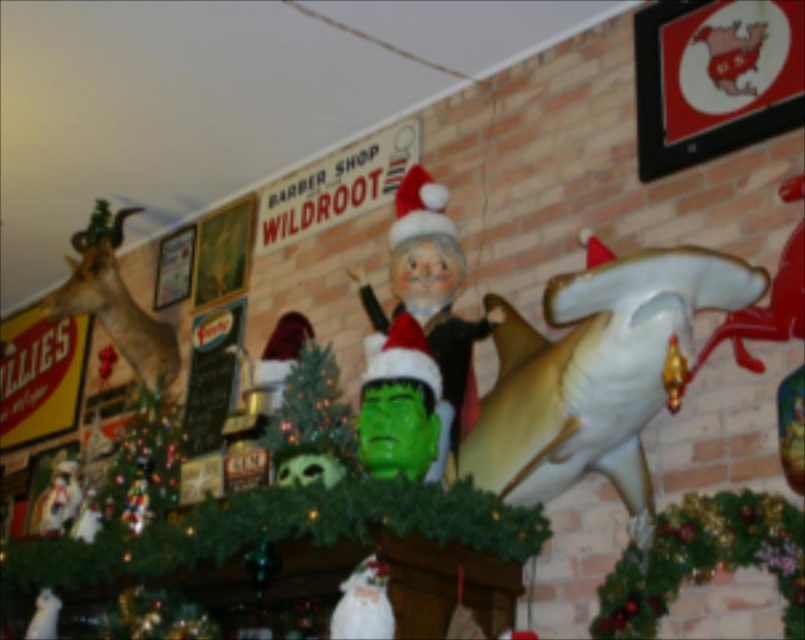
You are a visitor looking at the holiday display. You notice the white glossy shark at right and the matte plastic santa at center. Which object is positioned lower on the mantelpiece?

The white glossy shark at right is positioned lower on the mantelpiece than the matte plastic santa at center.

You are a visitor at this holiday display and want to take a photo of both the white glossy shark at right and the matte plastic santa at center. To ensure both are in frame, should you position yourself to the left or the right of the display?

You should position yourself to the left of the display so that the white glossy shark at right and the matte plastic santa at center are both visible in your photo. Since the white glossy shark at right is to the right of the matte plastic santa at center, positioning yourself to the left will allow you to capture both objects within the frame.